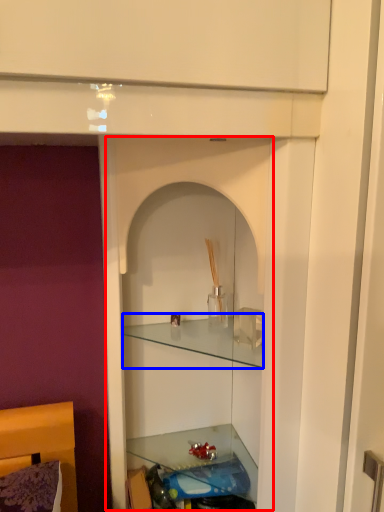
Question: Which point is closer to the camera, cabinet (highlighted by a red box) or cabinet (highlighted by a blue box)?

Choices:
 (A) cabinet
 (B) cabinet

Answer: (A)